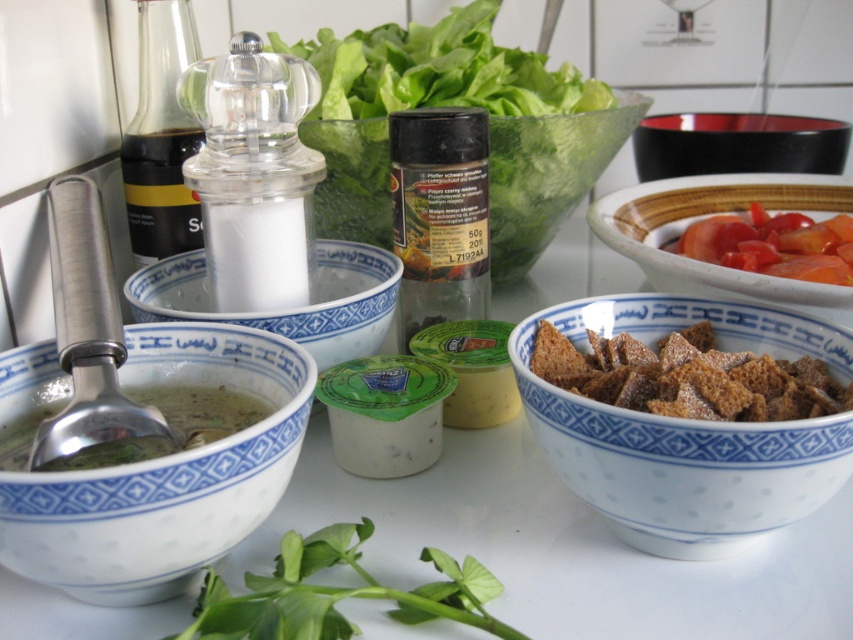
Question: Among these objects, which one is nearest to the camera?

Choices:
 (A) black glossy bowl at upper right
 (B) tomato salad at right
 (C) brown crumbly bread at right

Answer: (C)

Question: Which point is farther to the camera?

Choices:
 (A) (735, 488)
 (B) (817, 273)
 (C) (33, 547)
 (D) (651, 401)

Answer: (B)

Question: Considering the relative positions of brown textured bowl at center and green matte soup at lower left in the image provided, where is brown textured bowl at center located with respect to green matte soup at lower left?

Choices:
 (A) right
 (B) left

Answer: (A)

Question: Does white porcelain bowl at lower left appear on the left side of white ceramic bowl at center?

Choices:
 (A) no
 (B) yes

Answer: (B)

Question: Estimate the real-world distances between objects in this image. Which object is closer to the black glossy bowl at upper right?

Choices:
 (A) transparent glass spice container at center
 (B) green leafy vegetable at center
 (C) green matte soup at lower left
 (D) tomato salad at right

Answer: (D)

Question: Can you confirm if white porcelain bowl at lower left is positioned above black glossy bowl at upper right?

Choices:
 (A) yes
 (B) no

Answer: (B)